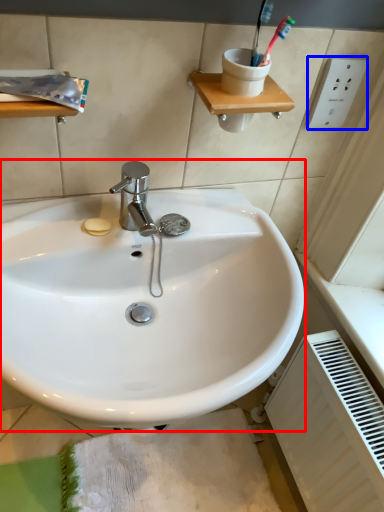
Question: Among these objects, which one is nearest to the camera, sink (highlighted by a red box) or electric outlet (highlighted by a blue box)?

Choices:
 (A) sink
 (B) electric outlet

Answer: (A)